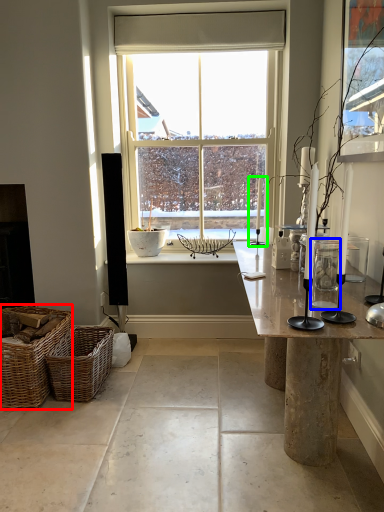
Question: Estimate the real-world distances between objects in this image. Which object is closer to picnic basket (highlighted by a red box), glass vase (highlighted by a blue box) or candle holder (highlighted by a green box)?

Choices:
 (A) glass vase
 (B) candle holder

Answer: (A)